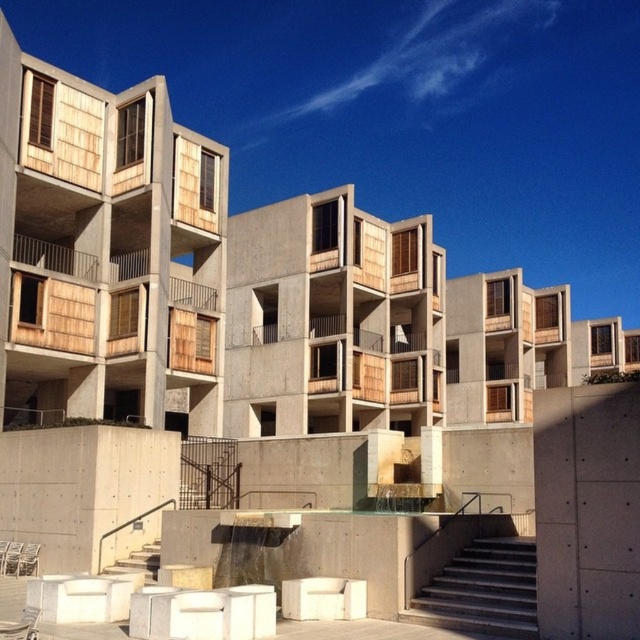
Which of these two, concrete stairs at lower center or white concrete stairs at lower left, stands shorter?

concrete stairs at lower center

Does point (440, 621) come farther from viewer compared to point (156, 550)?

That is False.

You are a GUI agent. You are given a task and a screenshot of the screen. Output one action in this format:
    pyautogui.click(x=<x>, y=<y>)
    Task: Click on the concrete stairs at lower center
    This screenshot has width=640, height=640.
    Given the screenshot: What is the action you would take?
    pyautogui.click(x=483, y=589)